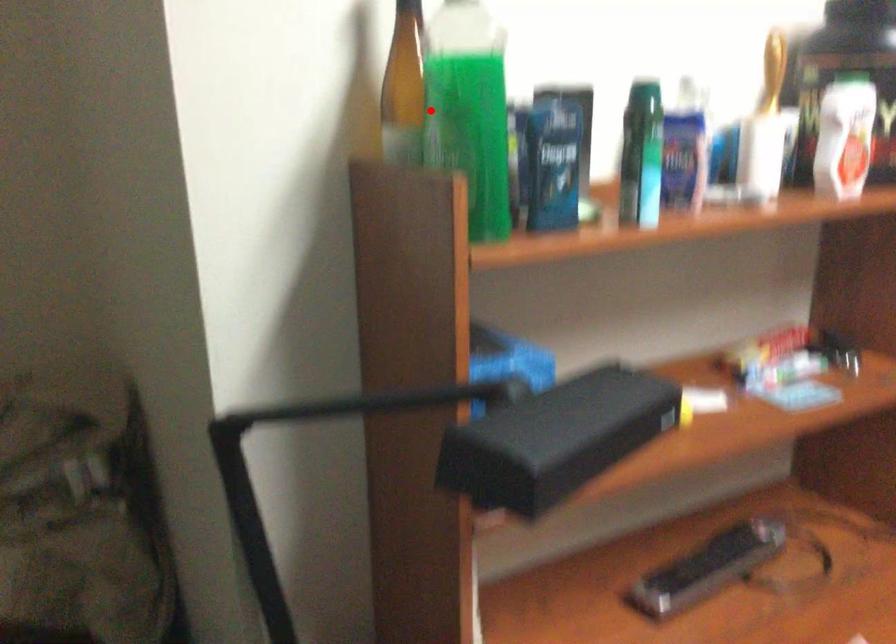
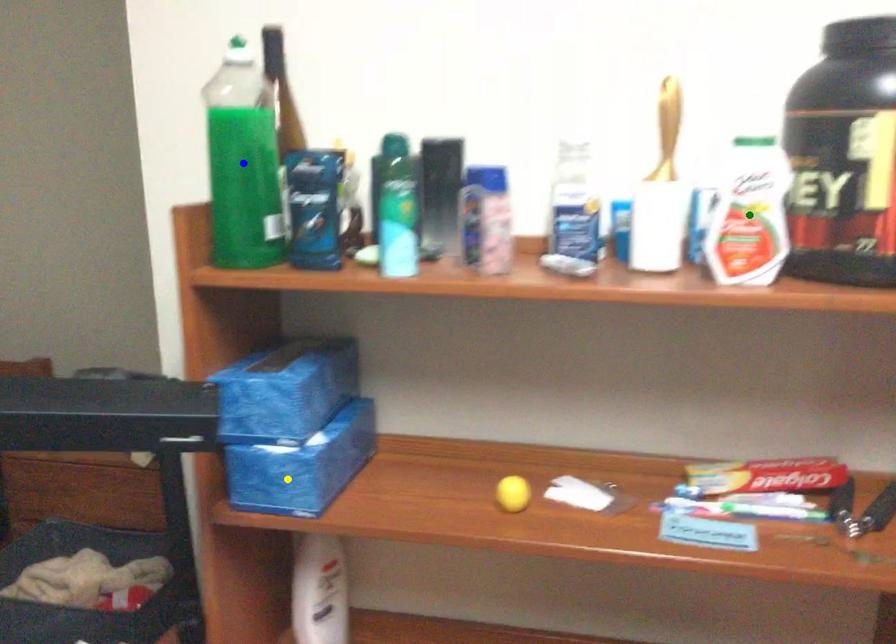
Question: I am providing you with two images of the same scene from different viewpoints. A red point is marked on the first image. You are given multiple points on the second image. Which point in image 2 is actually the same real-world point as the red point in image 1?

Choices:
 (A) green point
 (B) yellow point
 (C) blue point

Answer: (C)